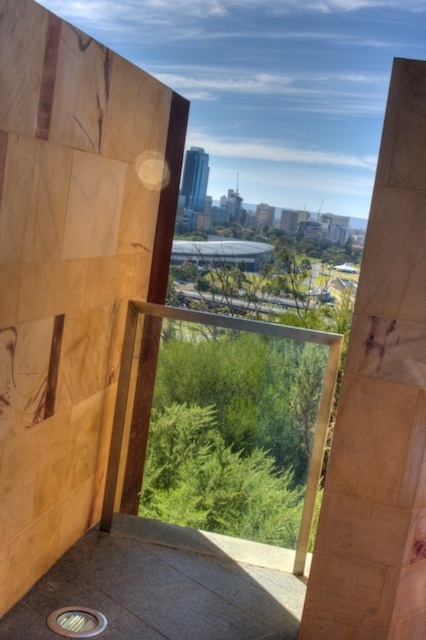
Question: Considering the relative positions of marble-like stone pillar at center and metallic circular drain at lower left in the image provided, where is marble-like stone pillar at center located with respect to metallic circular drain at lower left?

Choices:
 (A) left
 (B) right

Answer: (B)

Question: Among these points, which one is nearest to the camera?

Choices:
 (A) (8, 323)
 (B) (63, 620)

Answer: (A)

Question: Which of the following is the closest to the observer?

Choices:
 (A) (x=334, y=618)
 (B) (x=51, y=310)
 (C) (x=57, y=609)

Answer: (A)

Question: Is marble-like stone pillar at center to the right of metallic circular drain at lower left from the viewer's perspective?

Choices:
 (A) no
 (B) yes

Answer: (B)

Question: Which object is closer to the camera taking this photo?

Choices:
 (A) marble-like stone pillar at center
 (B) metallic circular drain at lower left
 (C) wooden at right

Answer: (A)

Question: Is wooden at right to the left of metallic circular drain at lower left from the viewer's perspective?

Choices:
 (A) no
 (B) yes

Answer: (A)